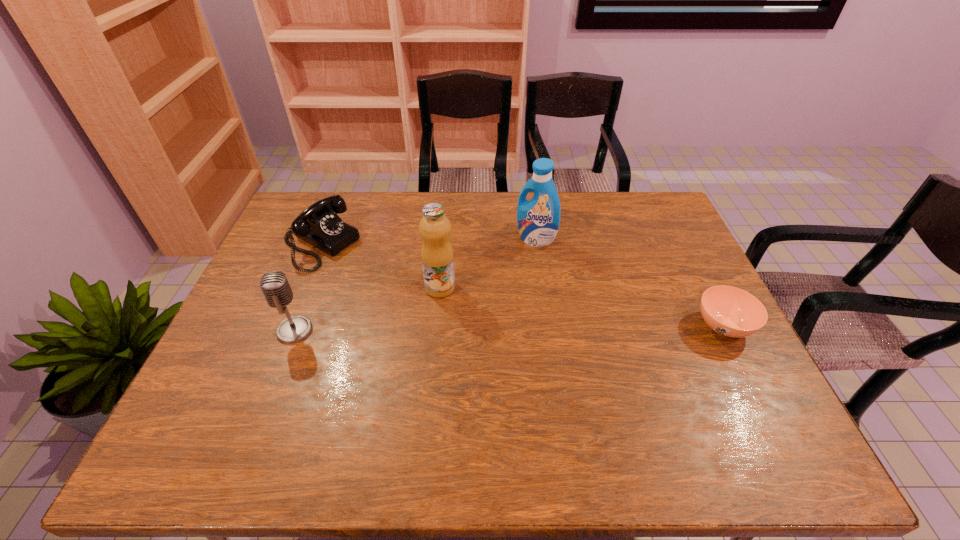
At what (x,y) coordinates should I click in order to perform the action: click on vacant space located 0.060m on the front label of the third object from left to right. Please return your answer as a coordinate pair (x, y). The width and height of the screenshot is (960, 540). Looking at the image, I should click on (470, 301).

What are the coordinates of `free location located 0.110m on the front label of the third object from left to right` in the screenshot? It's located at (486, 307).

Locate an element on the screen. The height and width of the screenshot is (540, 960). vacant region located on the front-facing side of the second object from right to left is located at coordinates (487, 287).

Locate an element on the screen. vacant area located 0.250m on the front-facing side of the second object from right to left is located at coordinates (481, 293).

Find the location of `free space located 0.350m on the front-facing side of the second object from right to left`. free space located 0.350m on the front-facing side of the second object from right to left is located at coordinates (461, 315).

Locate an element on the screen. Image resolution: width=960 pixels, height=540 pixels. vacant space positioned on the dial of the telephone is located at coordinates (436, 311).

The image size is (960, 540). Find the location of `free space located on the dial of the telephone`. free space located on the dial of the telephone is located at coordinates (386, 284).

Where is `vacant region located 0.370m on the dial of the telephone`? Image resolution: width=960 pixels, height=540 pixels. vacant region located 0.370m on the dial of the telephone is located at coordinates (439, 313).

At what (x,y) coordinates should I click in order to perform the action: click on detergent that is at the far edge. Please return your answer as a coordinate pair (x, y). Looking at the image, I should click on (538, 219).

Where is `telephone present at the far edge`? telephone present at the far edge is located at coordinates (319, 225).